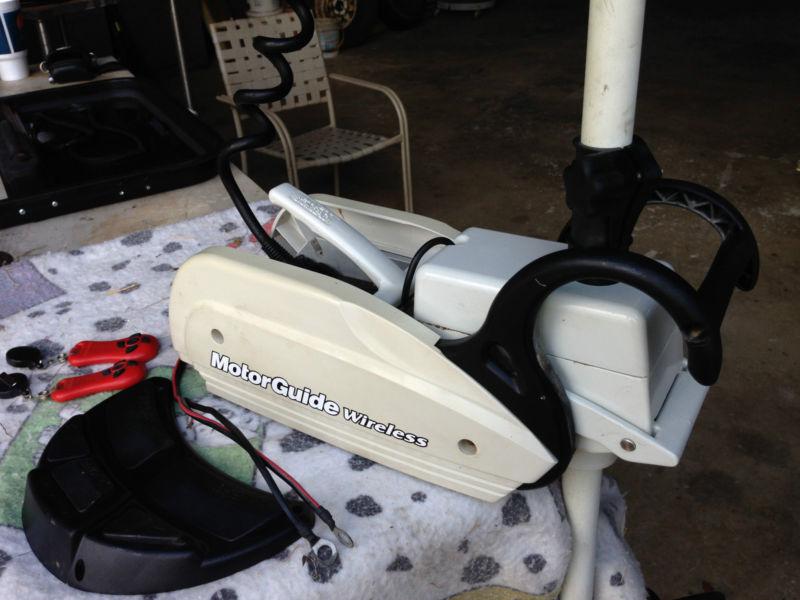
Where is `handle`? handle is located at coordinates (702, 314).